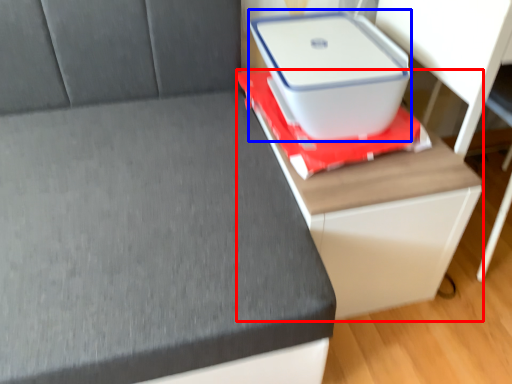
Question: Among these objects, which one is nearest to the camera, table (highlighted by a red box) or storage box (highlighted by a blue box)?

Choices:
 (A) table
 (B) storage box

Answer: (A)